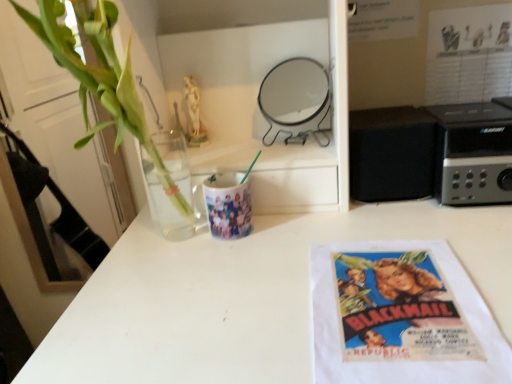
Question: Does point (446, 299) appear closer or farther from the camera than point (510, 52)?

Choices:
 (A) closer
 (B) farther

Answer: (A)

Question: Based on their positions, is white paper towel at lower right located to the left or right of vintage paper poster at upper right?

Choices:
 (A) left
 (B) right

Answer: (A)

Question: Considering the real-world distances, which object is farthest from the black matte speaker at right, which ranks as the 2th appliance in left-to-right order?

Choices:
 (A) vintage paper poster at upper right
 (B) black plastic stereo at right, the first appliance when ordered from right to left
 (C) white paper towel at lower right
 (D) matte ceramic mug at center
 (E) green leafy plant at left

Answer: (E)

Question: Estimate the real-world distances between objects in this image. Which object is farther from the green leafy plant at left?

Choices:
 (A) matte ceramic mug at center
 (B) white paper towel at lower right
 (C) vintage paper poster at upper right
 (D) black matte speaker at right, which ranks as the 2th appliance in left-to-right order
 (E) metallic round mirror at upper center, the third appliance from the right

Answer: (C)